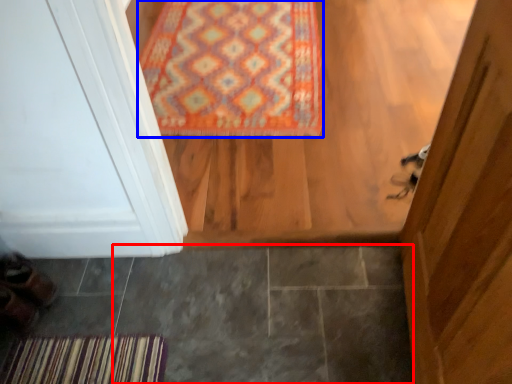
Question: Which point is further to the camera, tile (highlighted by a red box) or mat (highlighted by a blue box)?

Choices:
 (A) tile
 (B) mat

Answer: (B)